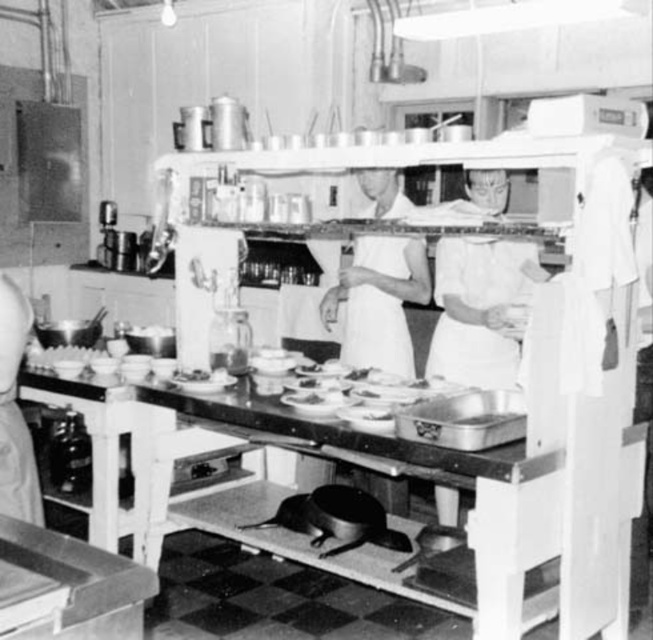
Image resolution: width=653 pixels, height=640 pixels. What do you see at coordinates (379, 301) in the screenshot? I see `white cloth at center` at bounding box center [379, 301].

Between point (342, 288) and point (8, 390), which one is positioned behind?

The point (342, 288) is behind.

Locate an element on the screen. The image size is (653, 640). white cloth at center is located at coordinates (379, 301).

Is white cloth at center positioned before white fabric apron at center?

That is True.

Between point (366, 301) and point (360, 342), which one is positioned in front?

Point (366, 301) is more forward.

Which is in front, point (390, 273) or point (342, 358)?

Point (390, 273) is more forward.

Find the location of a particular element. The height and width of the screenshot is (640, 653). white cloth at center is located at coordinates (379, 301).

Between white fabric apron at center and white fabric apron at left, which one is positioned higher?

white fabric apron at center is above.

Is white fabric apron at center smaller than white fabric apron at left?

Incorrect, white fabric apron at center is not smaller in size than white fabric apron at left.

Is point (406, 243) closer to viewer compared to point (20, 428)?

That is False.

At what (x,y) coordinates should I click in order to perform the action: click on white fabric apron at center. Please return your answer as a coordinate pair (x, y). This screenshot has height=640, width=653. Looking at the image, I should click on (375, 332).